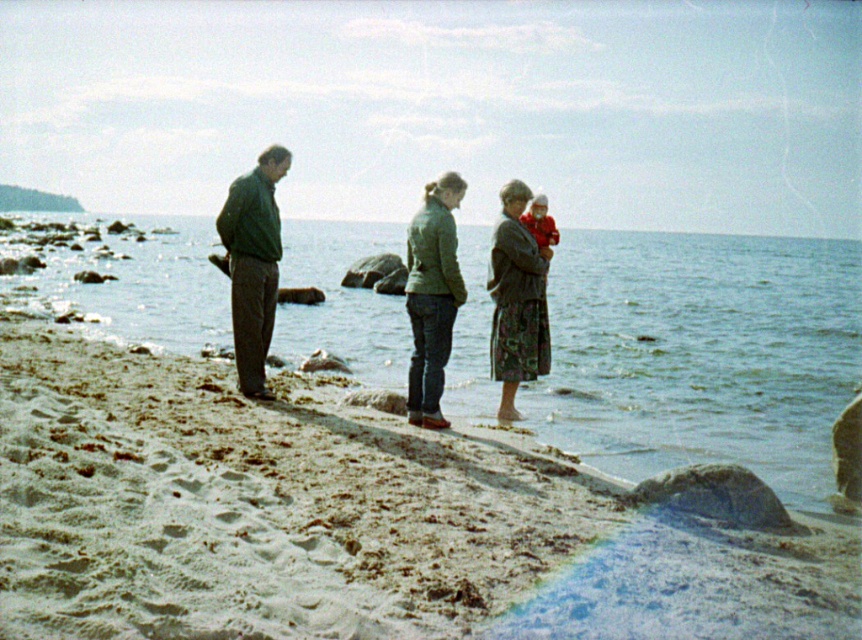
Question: Which of the following is the closest to the observer?

Choices:
 (A) floral skirt at center
 (B) green matte jacket at center
 (C) green matte jacket at left
 (D) clear water at lower left

Answer: (B)

Question: Estimate the real-world distances between objects in this image. Which object is farther from the sandy beach at lower left?

Choices:
 (A) green matte jacket at left
 (B) floral skirt at center
 (C) clear water at lower left
 (D) green matte jacket at center

Answer: (C)

Question: Does clear water at lower left appear on the right side of green matte jacket at center?

Choices:
 (A) yes
 (B) no

Answer: (A)

Question: Which of the following is the closest to the observer?

Choices:
 (A) floral skirt at center
 (B) green matte jacket at center
 (C) green matte jacket at left
 (D) clear water at lower left

Answer: (B)

Question: Is sandy beach at lower left to the left of green matte jacket at left from the viewer's perspective?

Choices:
 (A) yes
 (B) no

Answer: (B)

Question: Does clear water at lower left come in front of green matte jacket at left?

Choices:
 (A) yes
 (B) no

Answer: (A)